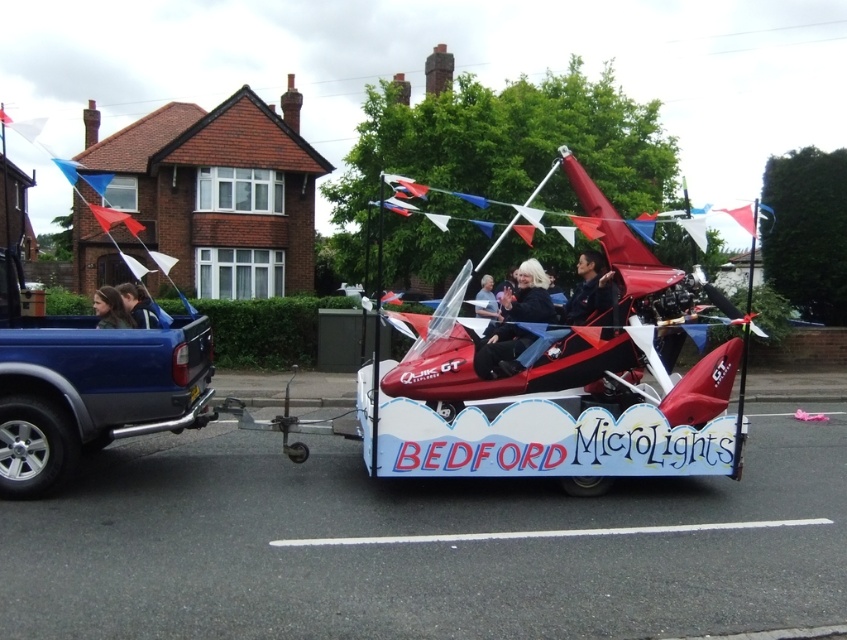
Who is more forward, (513, 365) or (131, 289)?

Point (513, 365) is in front.

You are a GUI agent. You are given a task and a screenshot of the screen. Output one action in this format:
    pyautogui.click(x=<x>, y=<y>)
    Task: Click on the matte black jacket at center
    
    Given the screenshot: What is the action you would take?
    pyautogui.click(x=588, y=289)

Is point (579, 310) in front of point (147, 316)?

Yes, it is.

At what (x,y) coordinates should I click in order to perform the action: click on matte black jacket at center. Please return your answer as a coordinate pair (x, y). This screenshot has width=847, height=640. Looking at the image, I should click on (588, 289).

Which of these two, blonde hair at left or light brown leather jacket at center, stands shorter?

light brown leather jacket at center is shorter.

How much distance is there between blonde hair at left and light brown leather jacket at center?

blonde hair at left and light brown leather jacket at center are 6.30 meters apart.

Measure the distance between blonde hair at left and camera.

blonde hair at left and camera are 25.45 feet apart.

Where is `blonde hair at left`? The width and height of the screenshot is (847, 640). blonde hair at left is located at coordinates (137, 305).

Which of these two, blonde hair at center or blonde hair at left, stands shorter?

With less height is blonde hair at center.

Consider the image. Can you confirm if blonde hair at center is positioned to the right of blonde hair at left?

Correct, you'll find blonde hair at center to the right of blonde hair at left.

Is point (119, 317) farther from camera compared to point (147, 301)?

That is False.

The image size is (847, 640). In order to click on blonde hair at center in this screenshot , I will do pyautogui.click(x=109, y=308).